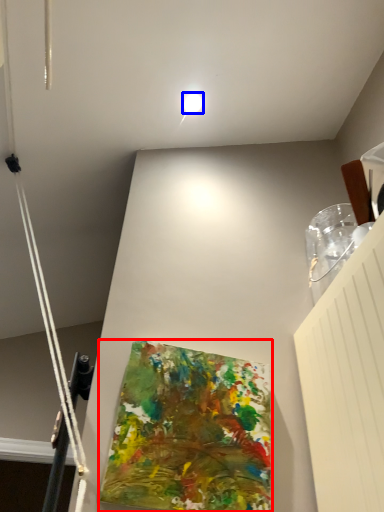
Question: Which point is further to the camera, art (highlighted by a red box) or droplight (highlighted by a blue box)?

Choices:
 (A) art
 (B) droplight

Answer: (B)